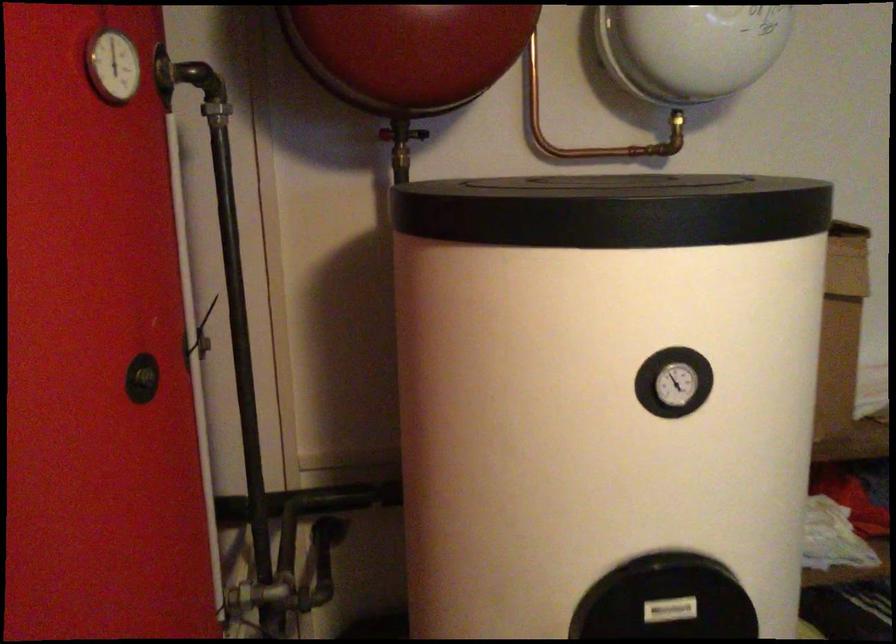
This screenshot has width=896, height=644. I want to click on black tank lid, so click(x=613, y=210).